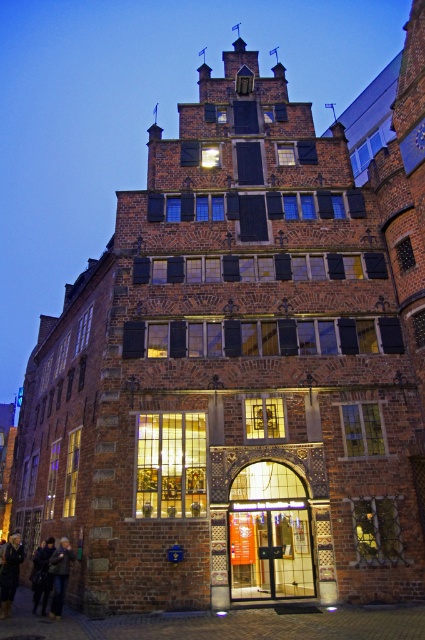
Question: Is dark brown leather boots at lower left to the right of dark blue leather jacket at lower left from the viewer's perspective?

Choices:
 (A) no
 (B) yes

Answer: (A)

Question: Which of these objects is positioned farthest from the dark brown leather boots at lower left?

Choices:
 (A) dark brown leather jacket at lower left
 (B) dark blue leather jacket at lower left

Answer: (A)

Question: Which point is farther to the camera?

Choices:
 (A) (67, 557)
 (B) (34, 561)

Answer: (B)

Question: Which point is farther to the camera?

Choices:
 (A) (5, 596)
 (B) (48, 582)

Answer: (B)

Question: Can you confirm if dark brown leather jacket at lower left is bigger than dark blue leather jacket at lower left?

Choices:
 (A) yes
 (B) no

Answer: (B)

Question: Can you confirm if dark brown leather boots at lower left is bigger than dark blue leather jacket at lower left?

Choices:
 (A) no
 (B) yes

Answer: (A)